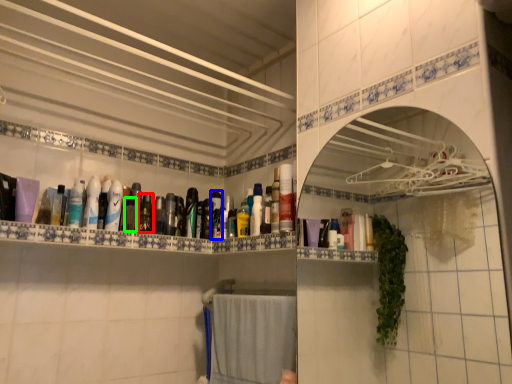
Question: Which object is positioned closest to mouthwash (highlighted by a red box)? Select from mouthwash (highlighted by a blue box) and mouthwash (highlighted by a green box).

Choices:
 (A) mouthwash
 (B) mouthwash

Answer: (B)